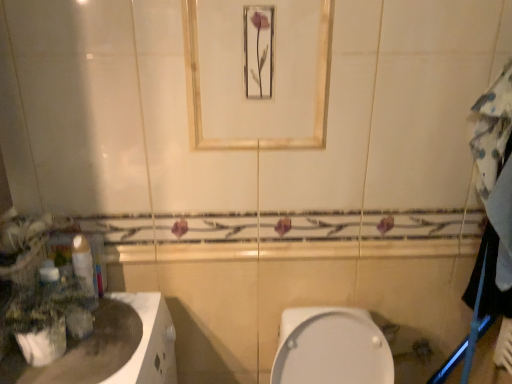
This screenshot has height=384, width=512. I want to click on empty space that is to the right of green matte plant at left, so click(x=111, y=349).